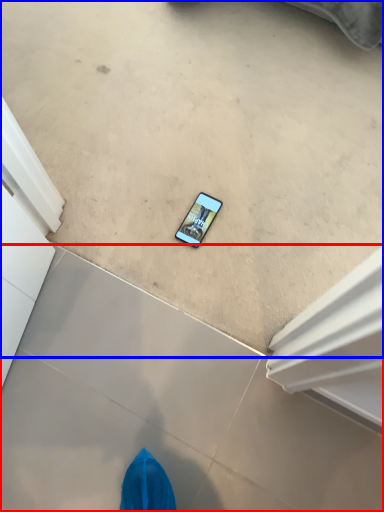
Question: Which object appears farthest to the camera in this image, concrete (highlighted by a red box) or concrete (highlighted by a blue box)?

Choices:
 (A) concrete
 (B) concrete

Answer: (B)